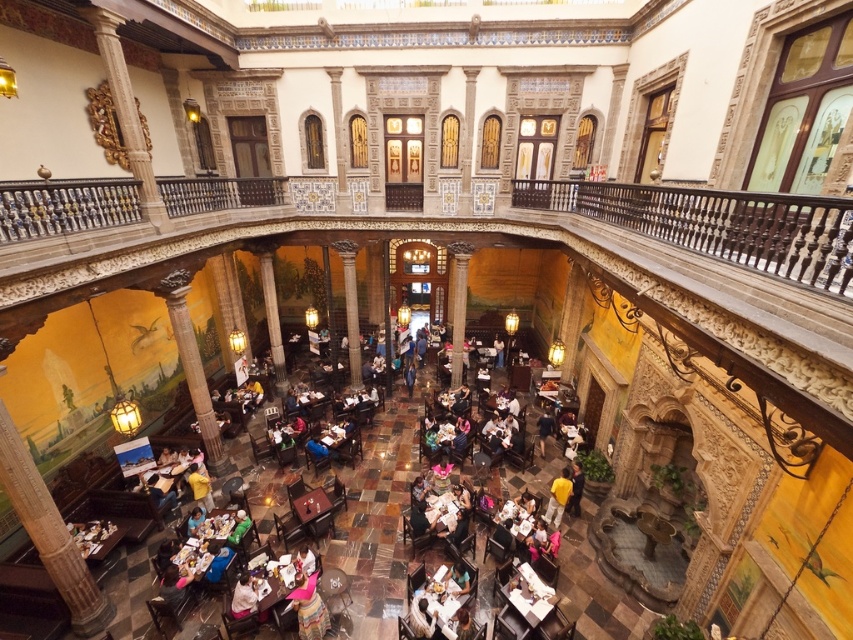
Is point (196, 499) positioned in front of point (550, 433)?

Yes, it is in front of point (550, 433).

Is point (199, 497) more distant than point (537, 428)?

No, it is in front of (537, 428).

Between point (190, 467) and point (543, 451), which one is positioned behind?

Positioned behind is point (543, 451).

Image resolution: width=853 pixels, height=640 pixels. Identify the location of yellow fabric shirt at lower center. (200, 486).

Who is lower down, white fabric shirt at lower center or green fabric person at center?

white fabric shirt at lower center is below.

Which is more to the left, white fabric shirt at lower center or green fabric person at center?

Positioned to the left is green fabric person at center.

Locate an element on the screen. This screenshot has width=853, height=640. white fabric shirt at lower center is located at coordinates (242, 596).

At what (x,y) coordinates should I click in order to perform the action: click on white fabric shirt at lower center. Please return your answer as a coordinate pair (x, y). Looking at the image, I should click on (242, 596).

Can you confirm if wooden table at lower left is shorter than dark blue shirt at center?

Indeed, wooden table at lower left has a lesser height compared to dark blue shirt at center.

From the picture: Between wooden table at lower left and dark blue shirt at center, which one appears on the right side from the viewer's perspective?

dark blue shirt at center

Is point (103, 545) positioned after point (538, 435)?

No, it is not.

Locate an element on the screen. Image resolution: width=853 pixels, height=640 pixels. wooden table at lower left is located at coordinates (96, 538).